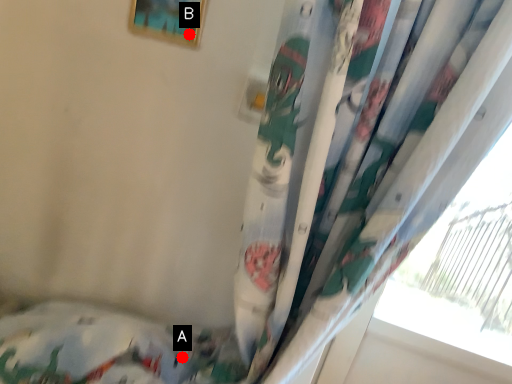
Question: Two points are circled on the image, labeled by A and B beside each circle. Which point appears farthest from the camera in this image?

Choices:
 (A) A is further
 (B) B is further

Answer: (A)